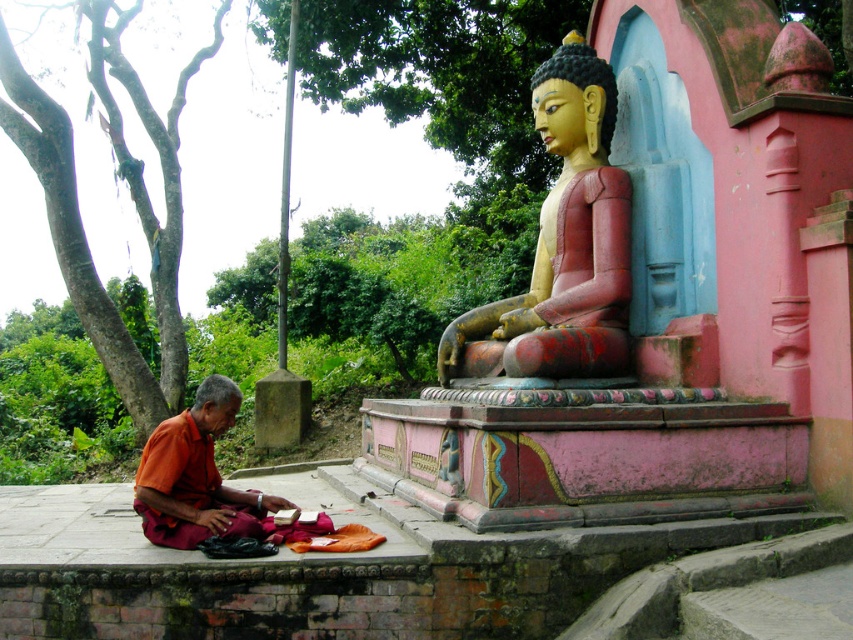
You are a visitor at the temple and want to take a photo of both the polished wood statue at center and the orange cloth at lower left. Which object should you focus on first if you want to capture both in the same frame without moving your camera?

The polished wood statue at center is taller than the orange cloth at lower left, so you should focus on the statue first to ensure it fits within the frame, then adjust to include the orange cloth at lower left.

You are a visitor at this peaceful garden and see the polished wood statue at center and the orange cloth at lower left. Which object is positioned to the left of the other?

The orange cloth at lower left is to the left of the polished wood statue at center.